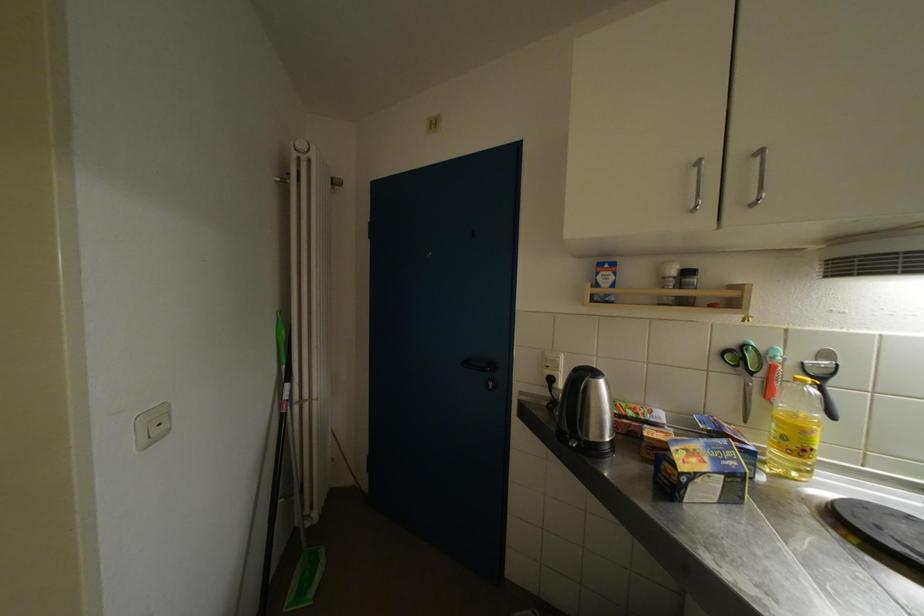
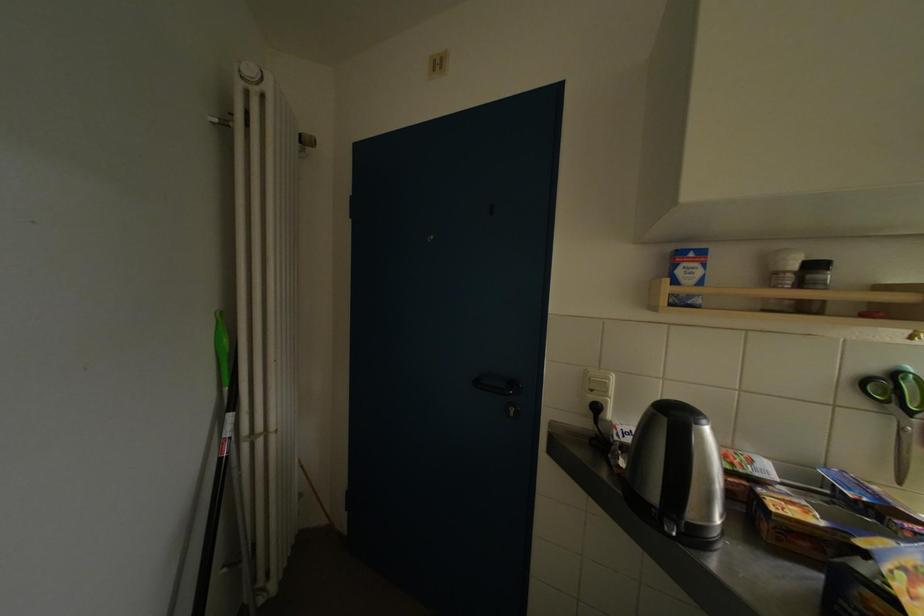
Where in the second image is the point corresponding to the point at 695,276 from the first image?

(821, 270)